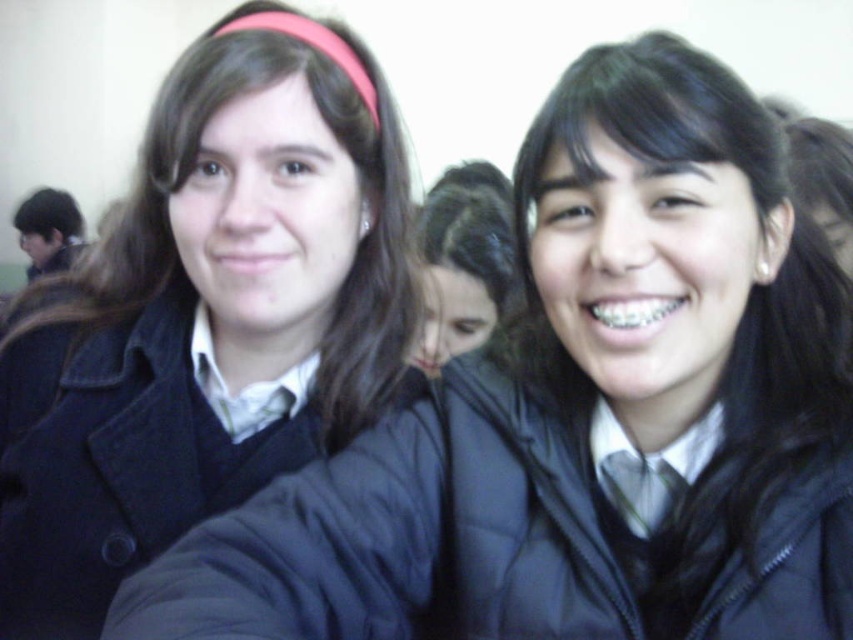
Question: Which point appears closest to the camera in this image?

Choices:
 (A) (451, 275)
 (B) (235, 429)

Answer: (B)

Question: Is matte black coat at left wider than dark brown hair at center?

Choices:
 (A) no
 (B) yes

Answer: (B)

Question: Is matte black coat at left closer to camera compared to dark brown hair at center?

Choices:
 (A) yes
 (B) no

Answer: (A)

Question: Which point appears farthest from the camera in this image?

Choices:
 (A) (492, 289)
 (B) (245, 484)

Answer: (A)

Question: Does matte black coat at left appear under dark brown hair at center?

Choices:
 (A) yes
 (B) no

Answer: (A)